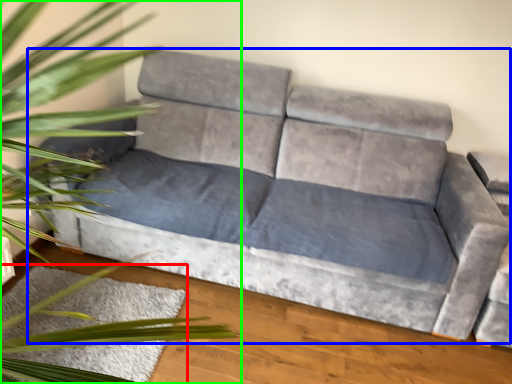
Question: Estimate the real-world distances between objects in this image. Which object is closer to mat (highlighted by a red box), studio couch (highlighted by a blue box) or houseplant (highlighted by a green box)?

Choices:
 (A) studio couch
 (B) houseplant

Answer: (B)